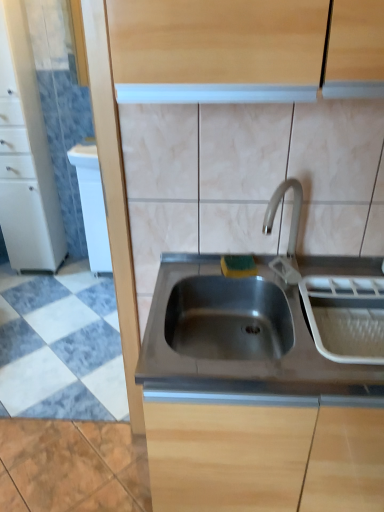
Question: Is white glossy dishwasher at left smaller than stainless steel sink at center, the first cabinetry positioned from the right?

Choices:
 (A) no
 (B) yes

Answer: (B)

Question: Is white glossy dishwasher at left placed right next to stainless steel sink at center, the second cabinetry from the top?

Choices:
 (A) no
 (B) yes

Answer: (A)

Question: Is white glossy dishwasher at left in front of stainless steel sink at center, placed as the second cabinetry when sorted from left to right?

Choices:
 (A) no
 (B) yes

Answer: (A)

Question: Is white glossy dishwasher at left shorter than stainless steel sink at center, placed as the second cabinetry when sorted from left to right?

Choices:
 (A) yes
 (B) no

Answer: (B)

Question: Considering the relative sizes of white glossy dishwasher at left and stainless steel sink at center, the first cabinetry positioned from the right, in the image provided, is white glossy dishwasher at left bigger than stainless steel sink at center, the first cabinetry positioned from the right,?

Choices:
 (A) no
 (B) yes

Answer: (A)

Question: Considering the positions of white marble floor at lower left and stainless steel sink at center, which is the first cabinetry in bottom-to-top order, in the image, is white marble floor at lower left wider or thinner than stainless steel sink at center, which is the first cabinetry in bottom-to-top order,?

Choices:
 (A) wide
 (B) thin

Answer: (A)

Question: Does point (31, 304) appear closer or farther from the camera than point (263, 429)?

Choices:
 (A) farther
 (B) closer

Answer: (A)

Question: From a real-world perspective, is white marble floor at lower left above or below stainless steel sink at center, the first cabinetry positioned from the right?

Choices:
 (A) below
 (B) above

Answer: (A)

Question: Visually, is white marble floor at lower left positioned to the left or to the right of stainless steel sink at center, positioned as the 2th cabinetry in back-to-front order?

Choices:
 (A) left
 (B) right

Answer: (A)

Question: Based on their positions, is white marble floor at lower left located to the left or right of white glossy dishwasher at left?

Choices:
 (A) right
 (B) left

Answer: (B)

Question: In terms of width, does white marble floor at lower left look wider or thinner when compared to white glossy dishwasher at left?

Choices:
 (A) thin
 (B) wide

Answer: (B)

Question: From their relative heights in the image, would you say white marble floor at lower left is taller or shorter than white glossy dishwasher at left?

Choices:
 (A) short
 (B) tall

Answer: (A)

Question: Choose the correct answer: Is white marble floor at lower left inside white glossy dishwasher at left or outside it?

Choices:
 (A) inside
 (B) outside

Answer: (B)

Question: Is stainless steel sink at center wider or thinner than stainless steel sink at center, positioned as the 2th cabinetry in back-to-front order?

Choices:
 (A) wide
 (B) thin

Answer: (B)

Question: From the image's perspective, is stainless steel sink at center positioned above or below stainless steel sink at center, the first cabinetry positioned from the right?

Choices:
 (A) below
 (B) above

Answer: (B)